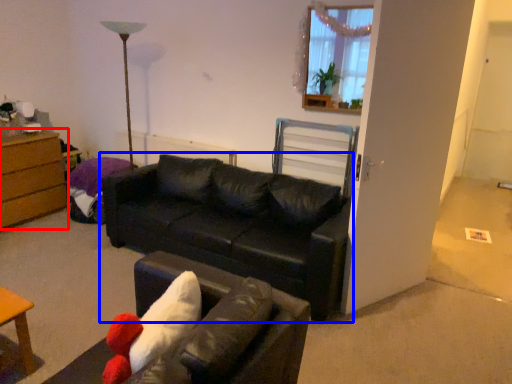
Question: Which point is further to the camera, chest of drawers (highlighted by a red box) or studio couch (highlighted by a blue box)?

Choices:
 (A) chest of drawers
 (B) studio couch

Answer: (A)